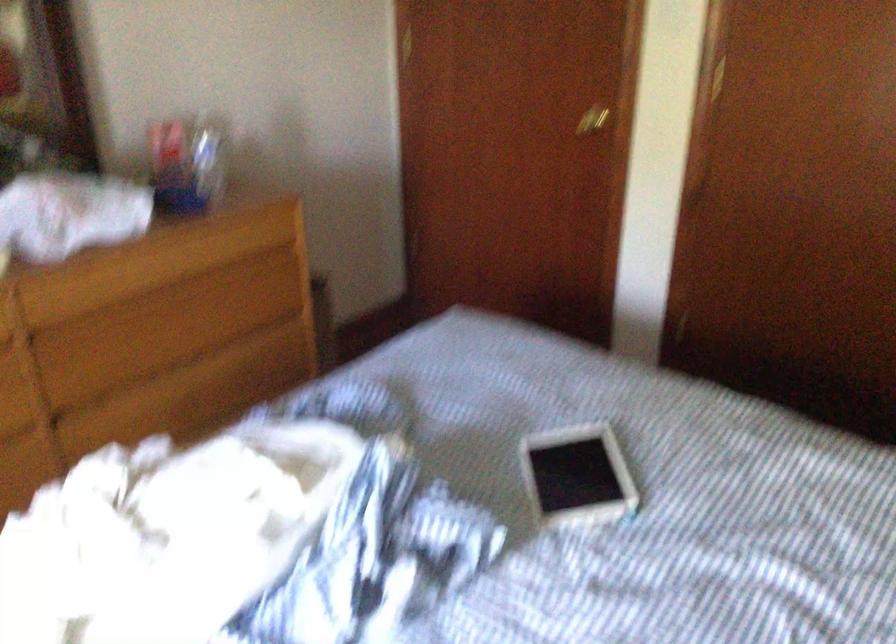
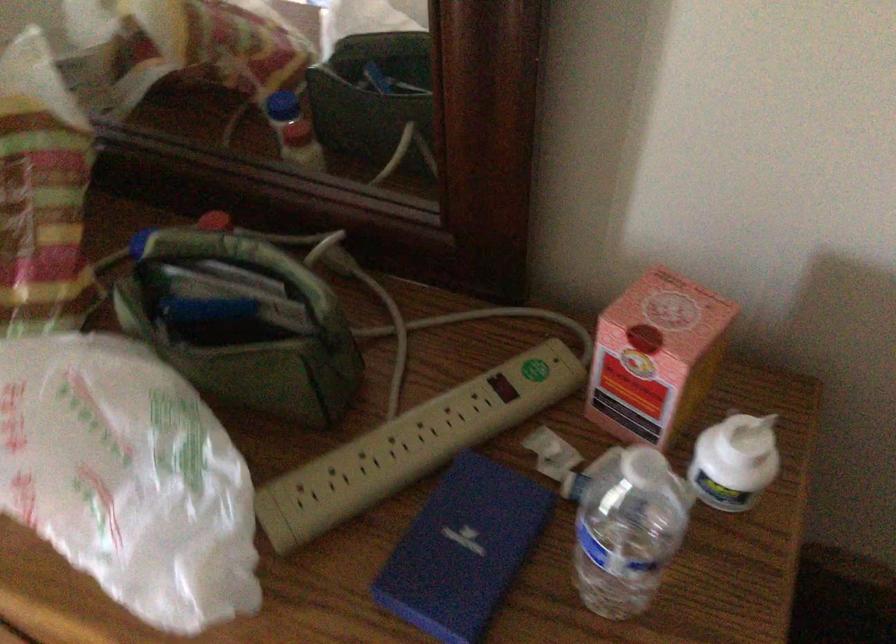
Locate, in the second image, the point that corresponds to the point at 139,182 in the first image.

(503, 386)